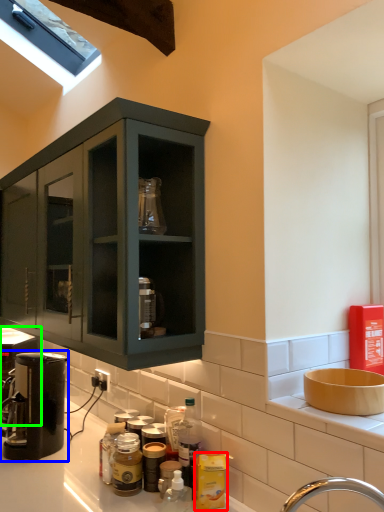
Question: Estimate the real-world distances between objects in this image. Which object is farther from bottle (highlighted by a red box), coffee machine (highlighted by a blue box) or coffee machine (highlighted by a green box)?

Choices:
 (A) coffee machine
 (B) coffee machine

Answer: (B)